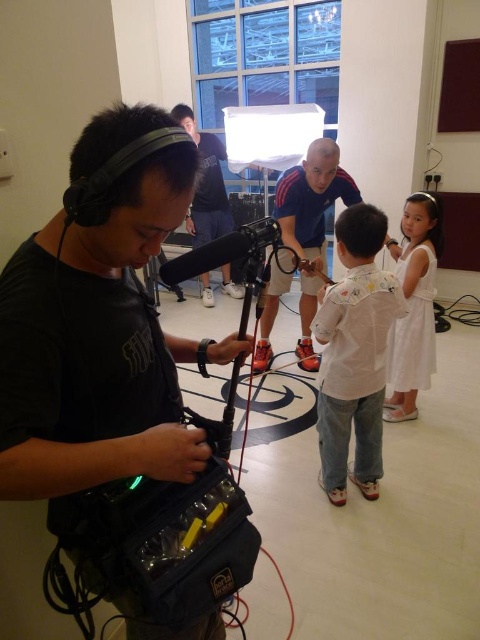
You are a photographer setting up for a group photo. You need to position the white cotton dress at right and the smooth beige shirt at center so that the dress is visible in the frame. Based on their current positions, which object is lower in the image and needs to be adjusted to ensure visibility?

The white cotton dress at right is located below the smooth beige shirt at center, so it is lower in the image and may need to be raised or repositioned to ensure visibility.